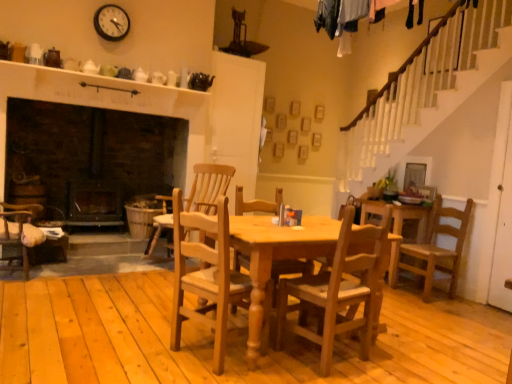
Where is `vacant area situated below light brown wooden chair at right, acting as the 1th chair starting from the right (from a real-world perspective)`? vacant area situated below light brown wooden chair at right, acting as the 1th chair starting from the right (from a real-world perspective) is located at coordinates (417, 294).